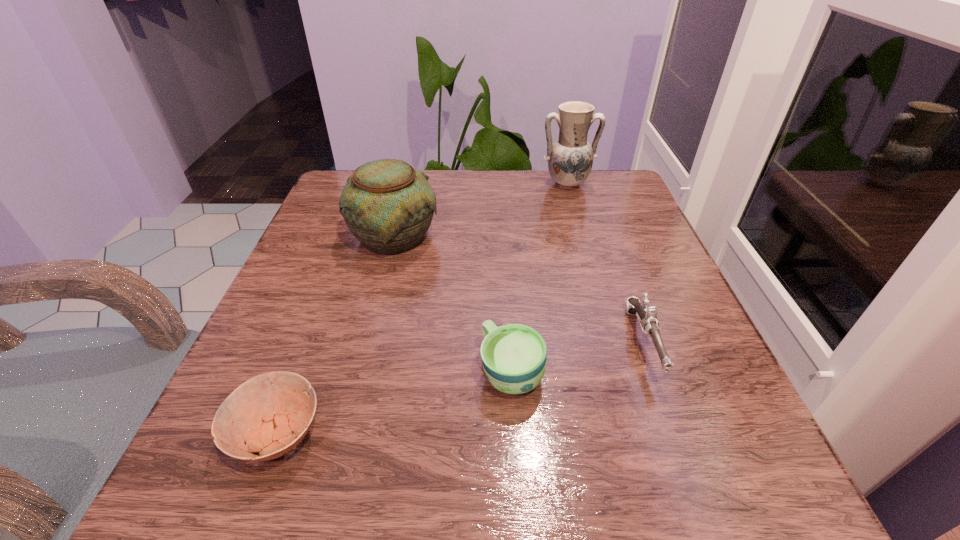
You are a GUI agent. You are given a task and a screenshot of the screen. Output one action in this format:
    pyautogui.click(x=<x>, y=<y>)
    Task: Click on the vacant space at the far edge of the desktop
    
    Given the screenshot: What is the action you would take?
    pyautogui.click(x=531, y=194)

Locate an element on the screen. This screenshot has height=540, width=960. vacant space at the near edge of the desktop is located at coordinates (428, 461).

The height and width of the screenshot is (540, 960). In the image, there is a desktop. What are the coordinates of `vacant space at the left edge` in the screenshot? It's located at (361, 256).

You are a GUI agent. You are given a task and a screenshot of the screen. Output one action in this format:
    pyautogui.click(x=<x>, y=<y>)
    Task: Click on the vacant space at the right edge of the desktop
    The width and height of the screenshot is (960, 540).
    Given the screenshot: What is the action you would take?
    pyautogui.click(x=608, y=271)

The height and width of the screenshot is (540, 960). In order to click on free point at the near left corner in this screenshot , I will do `click(228, 475)`.

Locate an element on the screen. The image size is (960, 540). vacant area at the far right corner is located at coordinates (579, 203).

In the image, there is a desktop. In order to click on free space at the near right corner in this screenshot , I will do `click(734, 495)`.

This screenshot has height=540, width=960. What are the coordinates of `unoccupied area between the farther pottery and the gun` in the screenshot? It's located at (605, 264).

Locate an element on the screen. The height and width of the screenshot is (540, 960). blank region between the gun and the cup is located at coordinates (578, 357).

Locate an element on the screen. vacant space in between the third object from left to right and the shortest object is located at coordinates (395, 403).